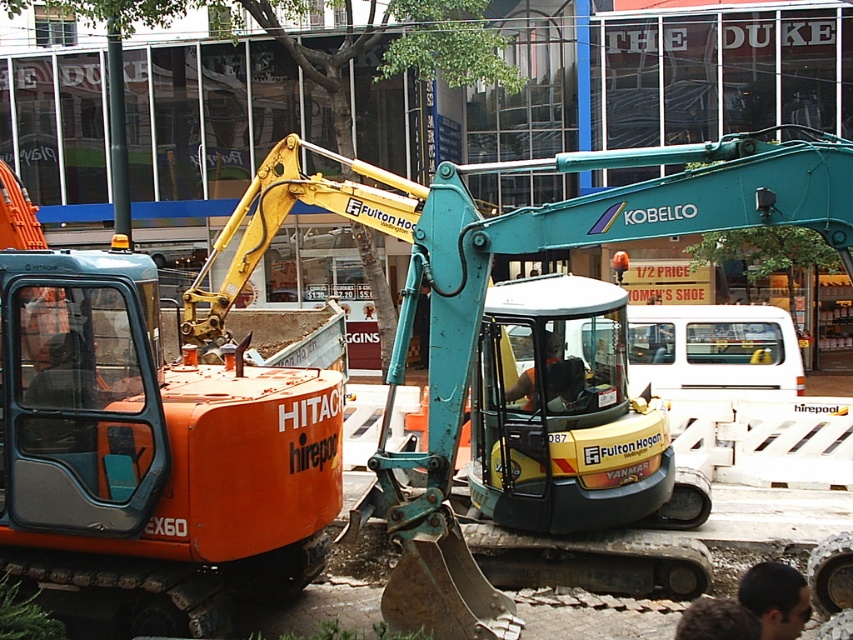
Question: Is the position of teal metallic excavator at center less distant than that of dark brown hair at lower right?

Choices:
 (A) no
 (B) yes

Answer: (A)

Question: Which of the following is the farthest from the observer?

Choices:
 (A) teal metallic excavator at center
 (B) orange fabric shirt at center

Answer: (B)

Question: Can you confirm if teal metallic excavator at center is positioned above orange fabric shirt at center?

Choices:
 (A) no
 (B) yes

Answer: (B)

Question: Which point is farther to the camera?

Choices:
 (A) (804, 593)
 (B) (422, 218)

Answer: (B)

Question: Can you confirm if teal metallic excavator at center is positioned to the left of dark brown hair at lower right?

Choices:
 (A) no
 (B) yes

Answer: (B)

Question: Which point is closer to the camera taking this photo?

Choices:
 (A) (581, 196)
 (B) (782, 621)

Answer: (B)